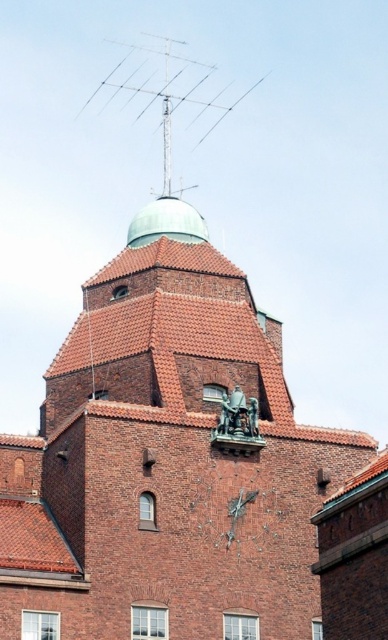
You are standing 50 meters away from the brown tiled roof at lower left. Can you safely walk towards it without getting too close?

The brown tiled roof at lower left is 48.16 meters away from the viewer. Since you are standing 50 meters away, you are already at a safe distance and can approach it while maintaining a safe proximity.

You are an architect assessing the building for maintenance. You notice the brown tiled roof at lower left and the metallic antenna at upper center. Which of these two features has a larger physical size according to the image?

The metallic antenna at upper center is larger than the brown tiled roof at lower left.

You are standing in front of the brick building and notice two points marked on the tower. The first point is at coordinates point (5,524) and the second is at point (206,106). Which of these points is closer to you?

Point (5,524) is closer to the viewer than point (206,106).